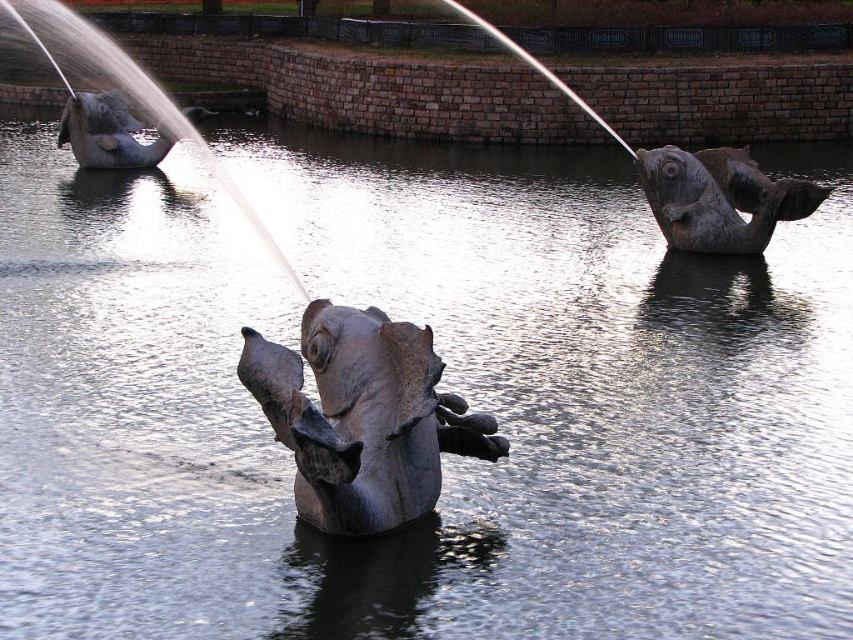
You are a sculptor who wants to place a new statue between the matte gray elephant at center and the rusty metal fish at right. Given that the new statue is 1.2 meters wide, can you fit it between them without moving either existing object?

The matte gray elephant at center has a lesser width compared to rusty metal fish at right. Since the new statue is 1.2 meters wide, we need to know the combined width of both objects to determine if there is enough space. However, the provided information only states that the elephant is narrower than the fish. Without specific measurements for either, it is impossible to confirm if the 1.2 meter statue will fit between them.

You are standing in front of a water fountain with two gray elephants. The matte gray elephant at center and the gray stone elephant at left. Which elephant is positioned to the right of the other?

The matte gray elephant at center is positioned to the right of the gray stone elephant at left.

You are designing a garden layout and need to place the matte gray elephant at center and the gray stone elephant at left in a way that maximizes space efficiency. Which elephant should you place closer to the garden entrance to ensure there is enough room for visitors to walk around?

The matte gray elephant at center occupies less space than the gray stone elephant at left, so placing the gray stone elephant at left closer to the entrance would allow more space around the smaller matte gray elephant at center for visitors to move comfortably.